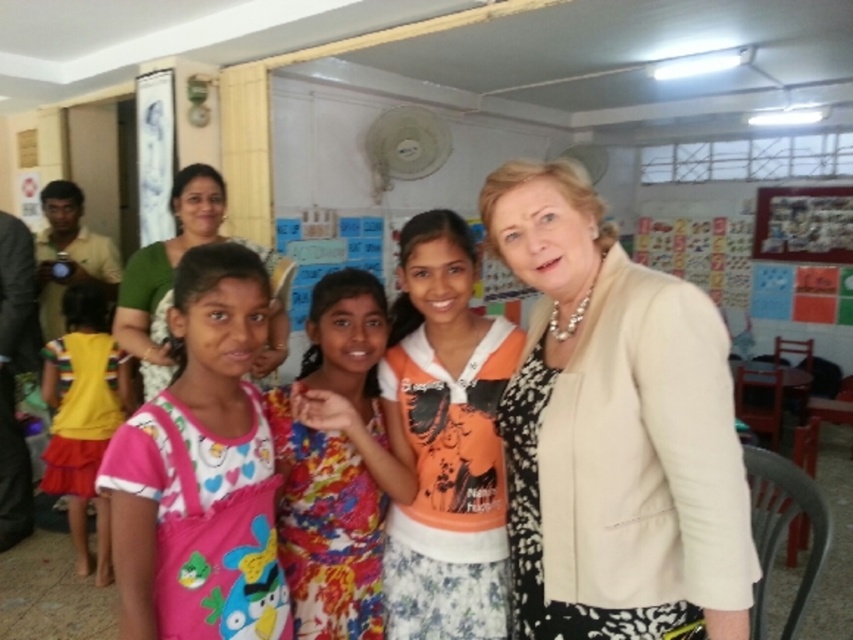
Based on the photo, between pink fabric dress at left and floral fabric dress at center, which one is positioned lower?

pink fabric dress at left is lower down.

Is the position of pink fabric dress at left more distant than that of floral fabric dress at center?

No, it is in front of floral fabric dress at center.

Image resolution: width=853 pixels, height=640 pixels. Describe the element at coordinates (201, 468) in the screenshot. I see `pink fabric dress at left` at that location.

This screenshot has height=640, width=853. Find the location of `pink fabric dress at left`. pink fabric dress at left is located at coordinates (201, 468).

In the scene shown: Does pink fabric dress at left have a larger size compared to green fabric at upper left?

No.

Measure the distance between point (244, 593) and camera.

Point (244, 593) and camera are 1.23 meters apart.

The width and height of the screenshot is (853, 640). Find the location of `pink fabric dress at left`. pink fabric dress at left is located at coordinates (201, 468).

Can you confirm if floral dress at center is taller than black fabric jacket at left?

No, floral dress at center is not taller than black fabric jacket at left.

Which is behind, point (320, 625) or point (0, 544)?

Positioned behind is point (0, 544).

Image resolution: width=853 pixels, height=640 pixels. Find the location of `floral dress at center`. floral dress at center is located at coordinates (328, 528).